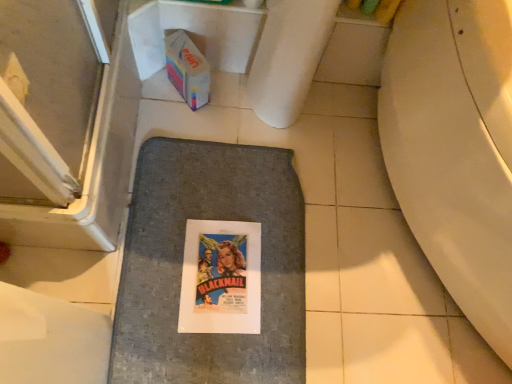
Question: From the image's perspective, is gray fabric bath mat at center positioned above or below multicolored cardboard box at upper left?

Choices:
 (A) below
 (B) above

Answer: (A)

Question: From a real-world perspective, is gray fabric bath mat at center physically located above or below multicolored cardboard box at upper left?

Choices:
 (A) below
 (B) above

Answer: (A)

Question: Looking at their shapes, would you say gray fabric bath mat at center is wider or thinner than multicolored cardboard box at upper left?

Choices:
 (A) wide
 (B) thin

Answer: (A)

Question: From a real-world perspective, relative to gray fabric bath mat at center, is multicolored cardboard box at upper left vertically above or below?

Choices:
 (A) above
 (B) below

Answer: (A)

Question: From the image's perspective, is multicolored cardboard box at upper left positioned above or below gray fabric bath mat at center?

Choices:
 (A) below
 (B) above

Answer: (B)

Question: Is multicolored cardboard box at upper left in front of or behind gray fabric bath mat at center in the image?

Choices:
 (A) front
 (B) behind

Answer: (B)

Question: Is multicolored cardboard box at upper left to the left or to the right of gray fabric bath mat at center in the image?

Choices:
 (A) right
 (B) left

Answer: (B)